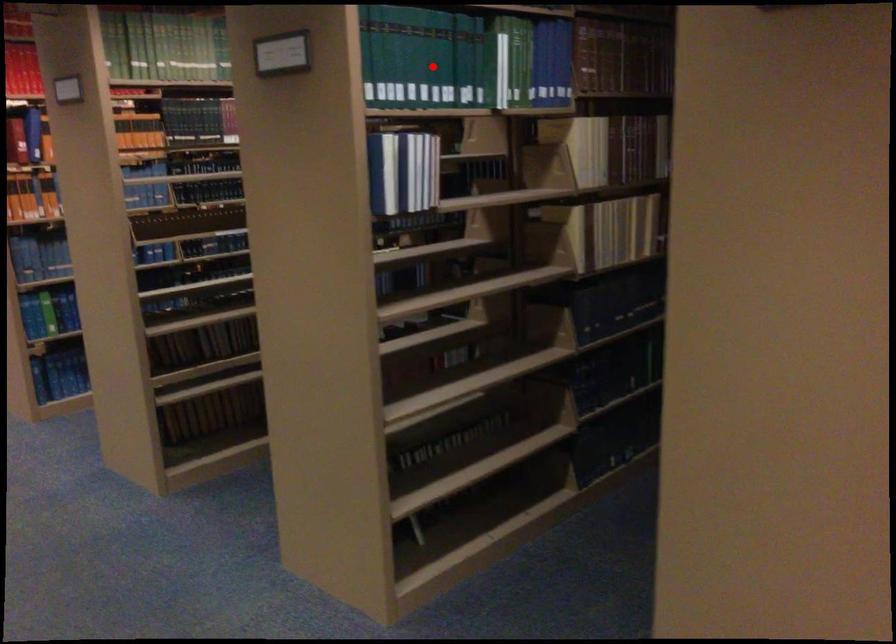
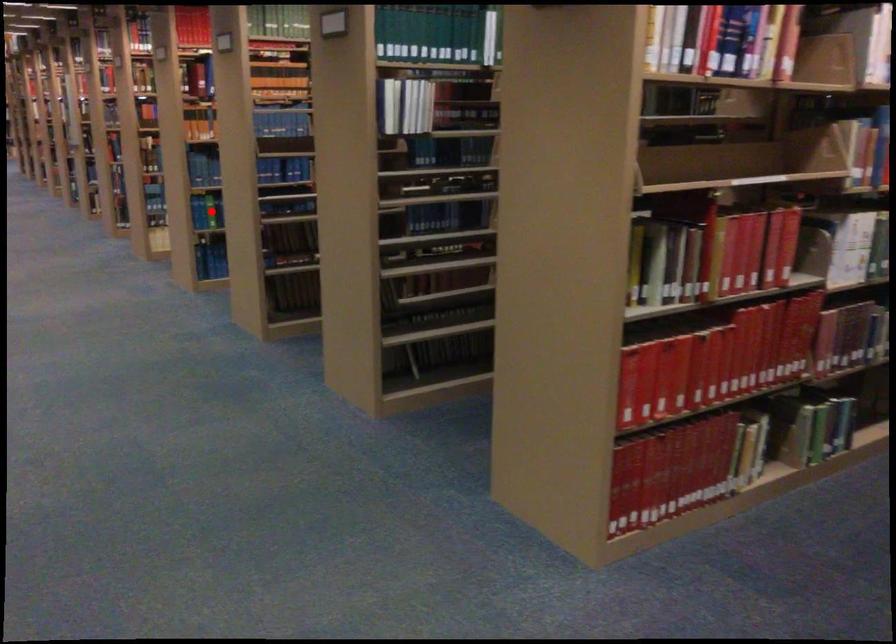
I am providing you with two images of the same scene from different viewpoints. A red point is marked on the first image and another point is marked on the second image. Is the red point in image1 aligned with the point shown in image2?

No